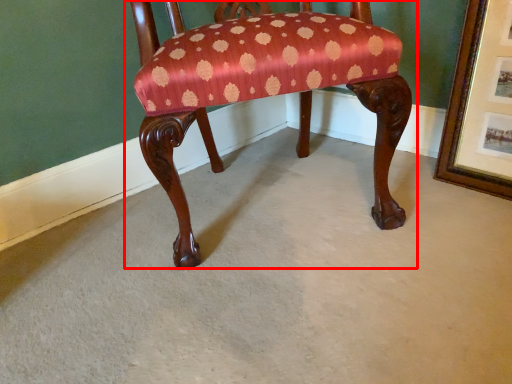
Question: Observing the image, what is the correct spatial positioning of chair (annotated by the red box) in reference to picture frame?

Choices:
 (A) right
 (B) left

Answer: (B)